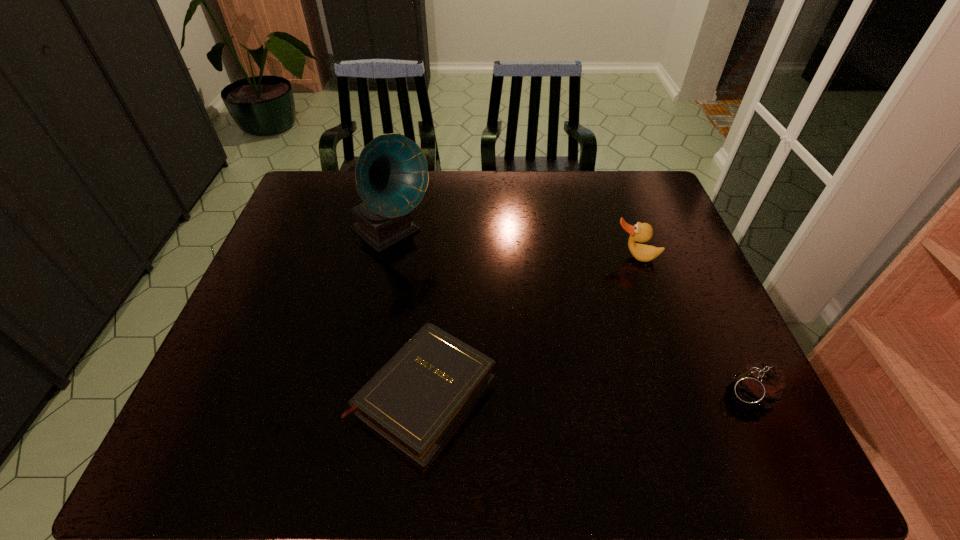
This screenshot has width=960, height=540. In order to click on free spot on the desktop that is between the shortest object and the rightmost object and is positioned from the horn of the phonograph_record in this screenshot , I will do `click(588, 393)`.

The width and height of the screenshot is (960, 540). I want to click on vacant space on the desktop that is between the Bible and the second shortest object and is positioned on the beak of the duck, so click(623, 393).